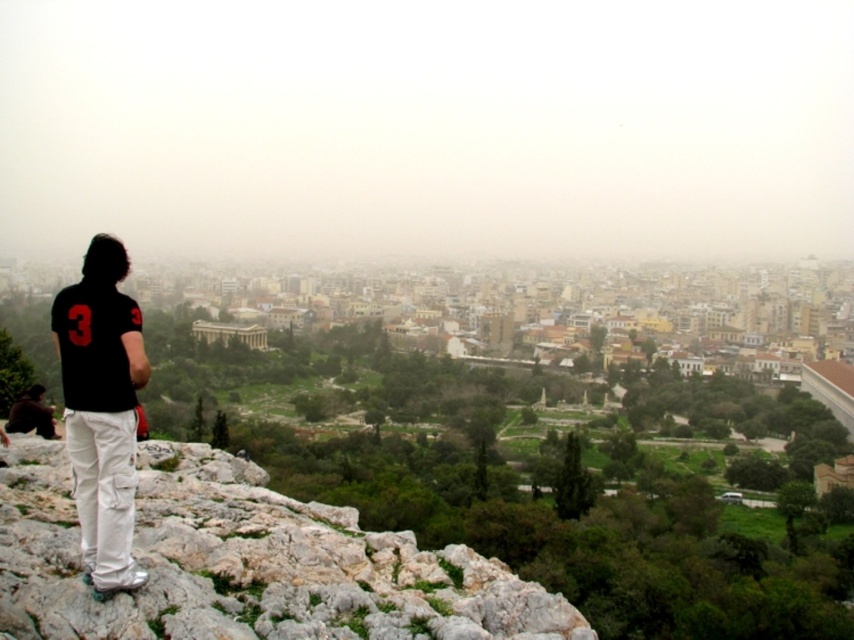
You are a fashion designer observing the city scene. You notice two clothing items in the image. Which clothing item is narrower in width between the black cotton shirt at left and the dark brown leather jacket at lower left?

The black cotton shirt at left is narrower in width than the dark brown leather jacket at lower left according to the description.

You are a photographer setting up a tripod to capture the cityscape. You notice the black cotton shirt at left and the dark brown leather jacket at lower left in your frame. Which clothing item appears larger in the photo?

The black cotton shirt at left appears larger in the photo because it is taller than the dark brown leather jacket at lower left.

You are a photographer trying to capture a clear shot of the black cotton shirt at left and the dark brown leather jacket at lower left. Which item should you focus on first if you want to ensure both are in focus without adjusting the camera settings?

The black cotton shirt at left is positioned over the dark brown leather jacket at lower left, so focusing on the black cotton shirt at left first will ensure both are in focus since it is closer to the camera.